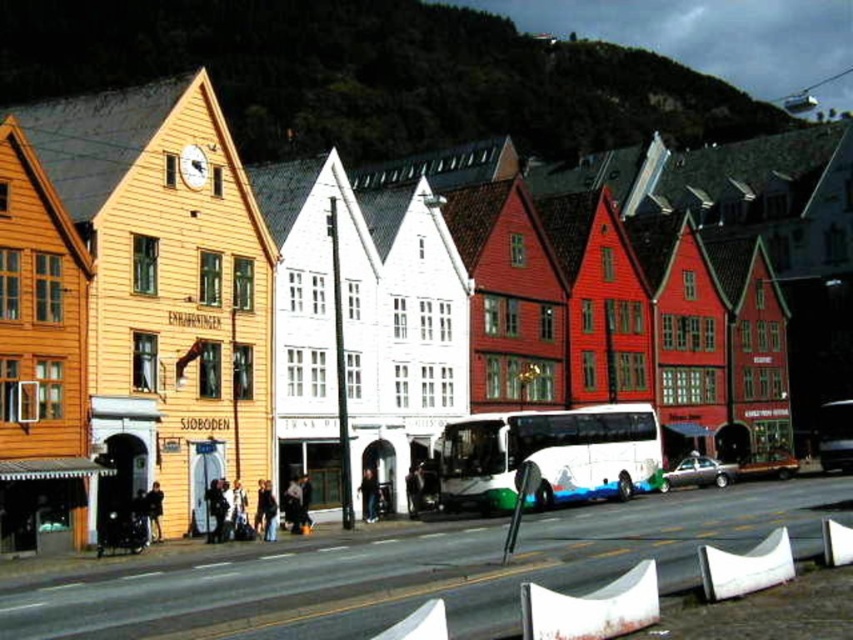
You are standing on the street looking at the colorful Norwegian houses. There are two points marked on the buildings. The first point is at coordinates point (495, 467) and the second is at point (759, 467). Which point is closer to you?

Point (495, 467) is closer to the viewer than point (759, 467).

You are standing at the entrance of the street scene and want to take a photo of the white glossy bus at center. If you are facing the bus, which direction should you turn to ensure the bus is in the center of your camera frame?

Since the white glossy bus at center is already at the center of the scene, you don not need to turn. Just face directly towards it to have it centered in your camera frame.

You are a tourist standing on the street and want to take a photo of the white glossy bus at center without any of the colorful Norwegian wooden houses in the background. Is there a clear line of sight to the bus from your current position?

The white glossy bus at center is located at point (549, 456), which means it is positioned in the central area of the scene. Since the scene description mentions the bus is at the center and the houses are part of the row along the street, there might be buildings on either side but not directly behind the bus. However, without specific information about the exact arrangement of the houses relative to the bus, it is uncertain if the background is clear. The answer cannot be definitively determined from